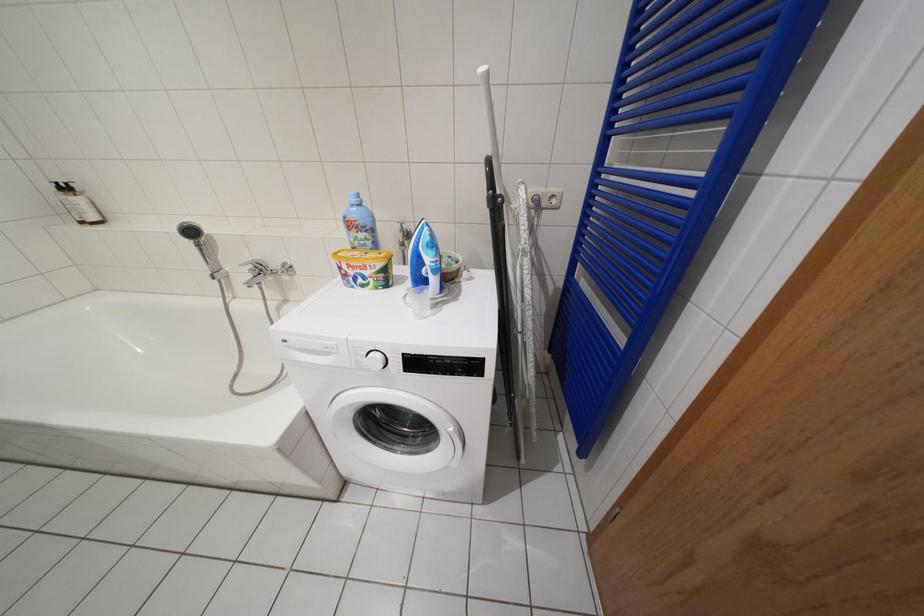
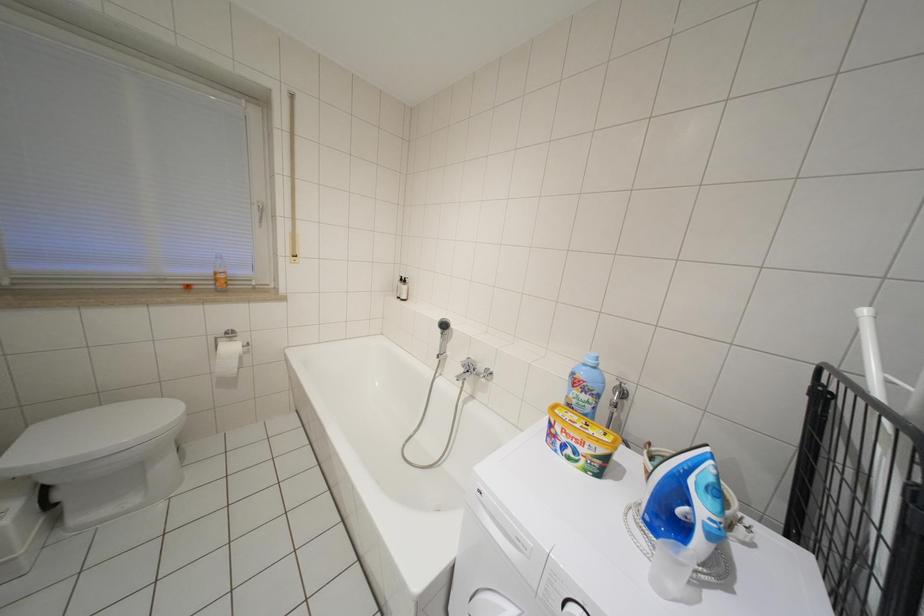
Question: The camera is either moving clockwise (left) or counter-clockwise (right) around the object. The first image is from the beginning of the video and the second image is from the end. Is the camera moving left or right when shooting the video?

Choices:
 (A) Left
 (B) Right

Answer: (B)